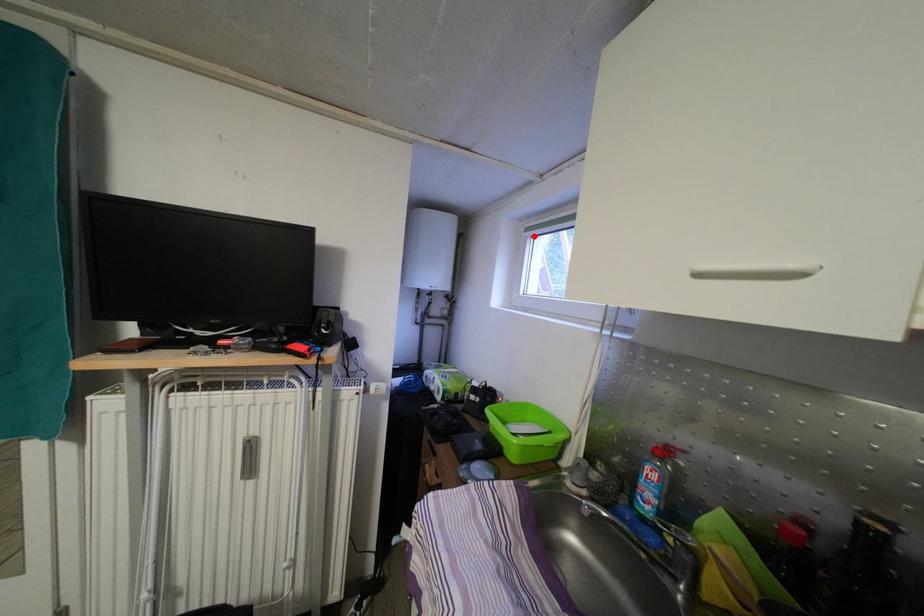
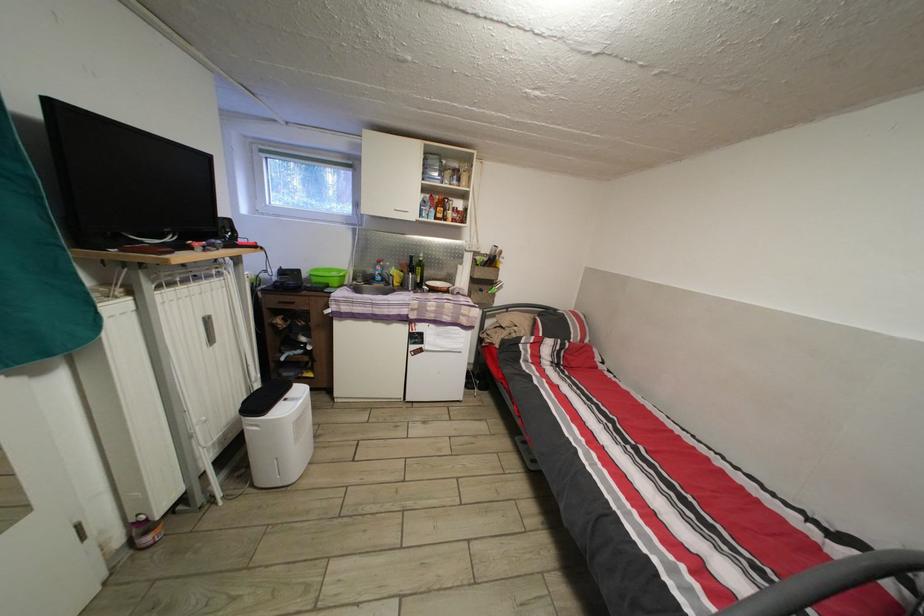
Where in the second image is the point corresponding to the highlighted location from the first image?

(269, 156)